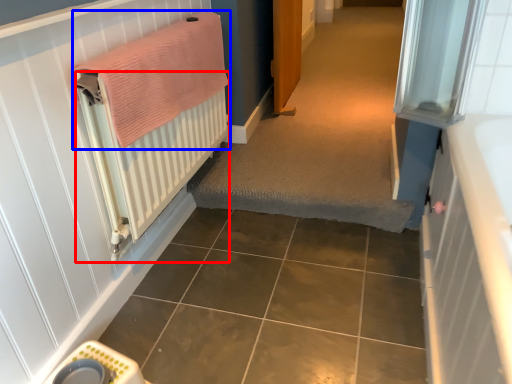
Question: Among these objects, which one is farthest to the camera, radiator (highlighted by a red box) or bath towel (highlighted by a blue box)?

Choices:
 (A) radiator
 (B) bath towel

Answer: (B)